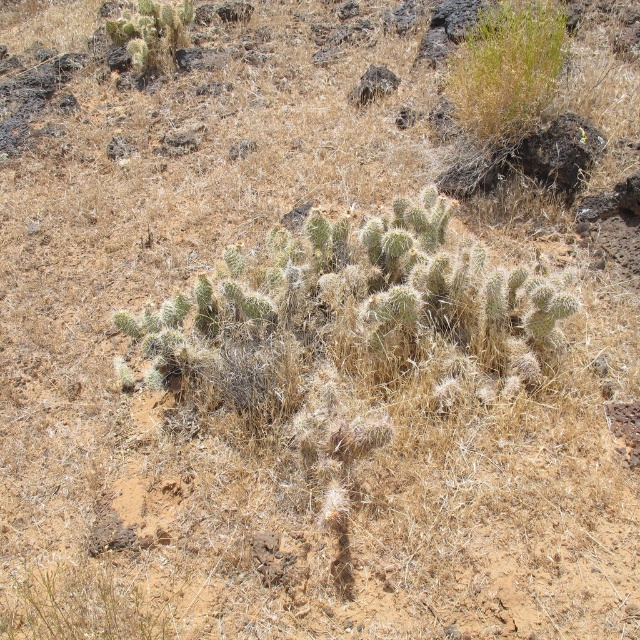
Question: Which point appears farthest from the camera in this image?

Choices:
 (A) (563, 44)
 (B) (161, 16)

Answer: (B)

Question: Does green fuzzy bush at upper center have a lesser width compared to green spiny cactus at upper left?

Choices:
 (A) yes
 (B) no

Answer: (A)

Question: Which object is farther from the camera taking this photo?

Choices:
 (A) green spiny cactus at upper left
 (B) green fuzzy bush at upper center

Answer: (A)

Question: Is green fuzzy bush at upper center thinner than green spiny cactus at upper left?

Choices:
 (A) no
 (B) yes

Answer: (B)

Question: Does green fuzzy bush at upper center have a greater width compared to green spiny cactus at upper left?

Choices:
 (A) no
 (B) yes

Answer: (A)